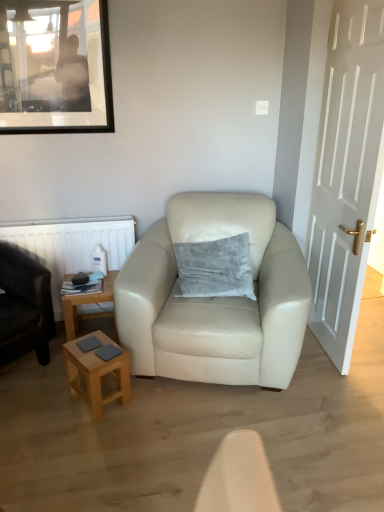
The height and width of the screenshot is (512, 384). In order to click on white wooden door at right in this screenshot , I will do pyautogui.click(x=346, y=173).

The image size is (384, 512). Describe the element at coordinates (346, 173) in the screenshot. I see `white wooden door at right` at that location.

What do you see at coordinates (55, 67) in the screenshot?
I see `matte black picture frame at upper left` at bounding box center [55, 67].

Measure the distance between point [43,246] and camera.

Point [43,246] and camera are 8.44 feet apart from each other.

Image resolution: width=384 pixels, height=512 pixels. What do you see at coordinates (87, 304) in the screenshot?
I see `woodenwoodentable at lower left` at bounding box center [87, 304].

From the picture: What is the approximate height of woodenwoodentable at lower left?

woodenwoodentable at lower left is 40.86 centimeters tall.

At what (x,y) coordinates should I click in order to perform the action: click on gray velvety pillow at center. Please return your answer as a coordinate pair (x, y). The width and height of the screenshot is (384, 512). Looking at the image, I should click on (215, 268).

Which is closer to the camera, (70, 355) or (1, 59)?

Point (70, 355) is positioned closer to the camera compared to point (1, 59).

Is light brown wooden stool at lower left located outside matte black picture frame at upper left?

Yes, light brown wooden stool at lower left is located beyond the bounds of matte black picture frame at upper left.

Is light brown wooden stool at lower left thinner than matte black picture frame at upper left?

No, light brown wooden stool at lower left is not thinner than matte black picture frame at upper left.

From a real-world perspective, is light brown wooden stool at lower left positioned above or below matte black picture frame at upper left?

From a real-world perspective, light brown wooden stool at lower left is physically below matte black picture frame at upper left.

Does matte black armchair at left, arranged as the 2th chair when viewed from the right, have a greater width compared to white plastic radiator at left?

Correct, the width of matte black armchair at left, arranged as the 2th chair when viewed from the right, exceeds that of white plastic radiator at left.

Where is `chair located on the left of white plastic radiator at left`? The image size is (384, 512). chair located on the left of white plastic radiator at left is located at coordinates (24, 306).

Is matte black armchair at left, arranged as the 2th chair when viewed from the right, not within white plastic radiator at left?

Indeed, matte black armchair at left, arranged as the 2th chair when viewed from the right, is completely outside white plastic radiator at left.

Considering the relative sizes of matte black picture frame at upper left and white wooden door at right in the image provided, is matte black picture frame at upper left shorter than white wooden door at right?

Correct, matte black picture frame at upper left is not as tall as white wooden door at right.

From the image's perspective, is matte black picture frame at upper left located above or below white wooden door at right?

Clearly, from the image's perspective, matte black picture frame at upper left is above white wooden door at right.

Does matte black picture frame at upper left turn towards white wooden door at right?

No, matte black picture frame at upper left is not oriented towards white wooden door at right.

Where is `table behind the matte black picture frame at upper left`? This screenshot has height=512, width=384. table behind the matte black picture frame at upper left is located at coordinates (87, 304).

Can you confirm if woodenwoodentable at lower left is wider than matte black picture frame at upper left?

Indeed, woodenwoodentable at lower left has a greater width compared to matte black picture frame at upper left.

Is woodenwoodentable at lower left to the left or to the right of matte black picture frame at upper left in the image?

woodenwoodentable at lower left is to the right of matte black picture frame at upper left.

Is light brown wooden stool at lower left beside woodenwoodentable at lower left?

No, light brown wooden stool at lower left is not beside woodenwoodentable at lower left.

Which of these two, light brown wooden stool at lower left or woodenwoodentable at lower left, is bigger?

woodenwoodentable at lower left is bigger.

Is light brown wooden stool at lower left taller than woodenwoodentable at lower left?

In fact, light brown wooden stool at lower left may be shorter than woodenwoodentable at lower left.

This screenshot has height=512, width=384. I want to click on table that appears above the light brown wooden stool at lower left (from the image's perspective), so click(87, 304).

From the picture: Is gray velvety pillow at center in contact with matte black picture frame at upper left?

No, gray velvety pillow at center is not beside matte black picture frame at upper left.

Which of these two, gray velvety pillow at center or matte black picture frame at upper left, stands taller?

With more height is matte black picture frame at upper left.

Image resolution: width=384 pixels, height=512 pixels. I want to click on picture frame that is above the gray velvety pillow at center (from a real-world perspective), so click(55, 67).

Looking at this image, how many degrees apart are the facing directions of gray velvety pillow at center and matte black picture frame at upper left?

They differ by 9.55 degrees in their facing directions.

Which of these two, white wooden door at right or white plastic radiator at left, is smaller?

Smaller between the two is white plastic radiator at left.

Locate an element on the screen. The width and height of the screenshot is (384, 512). radiator that appears below the white wooden door at right (from the image's perspective) is located at coordinates 72,245.

Is white wooden door at right taller or shorter than white plastic radiator at left?

Considering their sizes, white wooden door at right has more height than white plastic radiator at left.

Would you say white plastic radiator at left is part of white wooden door at right's contents?

No, white plastic radiator at left is not inside white wooden door at right.

You are a GUI agent. You are given a task and a screenshot of the screen. Output one action in this format:
    pyautogui.click(x=<x>, y=<y>)
    Task: Click on the stool in front of the matte black picture frame at upper left
    The width and height of the screenshot is (384, 512).
    Given the screenshot: What is the action you would take?
    (x=97, y=374)

Image resolution: width=384 pixels, height=512 pixels. I want to click on radiator above the matte black armchair at left, arranged as the 2th chair when viewed from the right (from a real-world perspective), so [72, 245].

From the image, which object appears to be farther from light brown wooden stool at lower left, woodenwoodentable at lower left or white wooden door at right?

Among the two, white wooden door at right is located further to light brown wooden stool at lower left.

Estimate the real-world distances between objects in this image. Which object is further from matte cream leather armchair at center, positioned as the 1th chair in right-to-left order, gray velvety pillow at center or white plastic radiator at left?

white plastic radiator at left lies further to matte cream leather armchair at center, positioned as the 1th chair in right-to-left order, than the other object.

Based on their spatial positions, is gray velvety pillow at center or matte black picture frame at upper left closer to white plastic radiator at left?

Based on the image, gray velvety pillow at center appears to be nearer to white plastic radiator at left.

Considering their positions, is gray velvety pillow at center positioned closer to matte black picture frame at upper left than light brown wooden stool at lower left?

gray velvety pillow at center is positioned closer to the anchor matte black picture frame at upper left.

Based on their spatial positions, is woodenwoodentable at lower left or matte black armchair at left, the 1th chair viewed from the left, closer to white plastic radiator at left?

Among the two, woodenwoodentable at lower left is located nearer to white plastic radiator at left.

Looking at this image, which object lies nearer to the anchor point matte black picture frame at upper left, white plastic radiator at left or light brown wooden stool at lower left?

white plastic radiator at left.

When comparing their distances from matte black picture frame at upper left, does matte cream leather armchair at center, placed as the second chair when sorted from left to right, or woodenwoodentable at lower left seem closer?

matte cream leather armchair at center, placed as the second chair when sorted from left to right, is closer to matte black picture frame at upper left.

Considering their positions, is gray velvety pillow at center positioned further to white plastic radiator at left than matte black armchair at left, the 1th chair viewed from the left?

gray velvety pillow at center.

Locate an element on the screen. The height and width of the screenshot is (512, 384). table located between matte black armchair at left, the 1th chair viewed from the left, and gray velvety pillow at center in the left-right direction is located at coordinates (87, 304).

I want to click on radiator between matte black armchair at left, arranged as the 2th chair when viewed from the right, and gray velvety pillow at center, in the horizontal direction, so click(72, 245).

Find the location of a particular element. radiator that lies between matte black picture frame at upper left and woodenwoodentable at lower left from top to bottom is located at coordinates (72, 245).

I want to click on pillow between light brown wooden stool at lower left and white wooden door at right, so click(x=215, y=268).